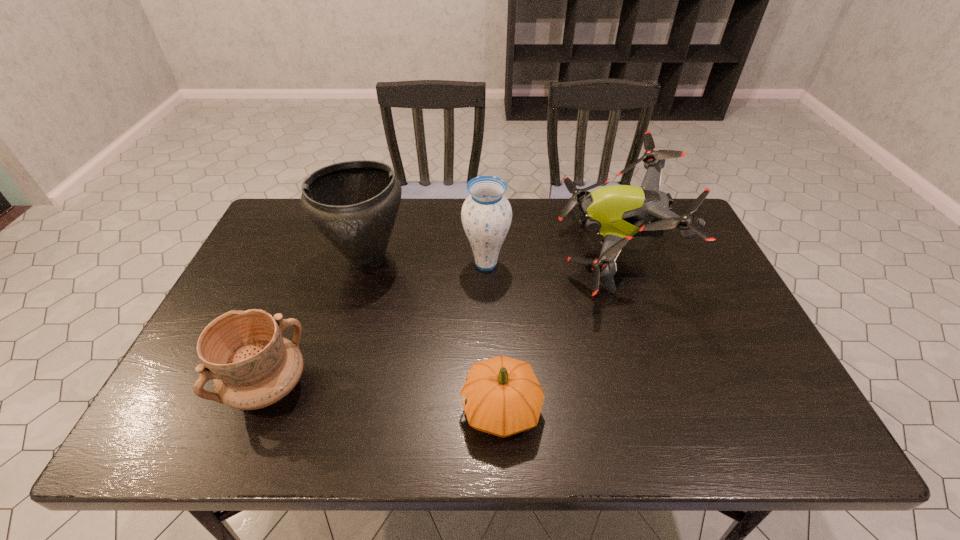
You are a GUI agent. You are given a task and a screenshot of the screen. Output one action in this format:
    pyautogui.click(x=<x>, y=<y>)
    Task: Click on the rightmost object
    
    Given the screenshot: What is the action you would take?
    pyautogui.click(x=617, y=213)

Where is `urn`? The width and height of the screenshot is (960, 540). urn is located at coordinates (354, 204).

The image size is (960, 540). Find the location of `vase`. vase is located at coordinates (486, 215).

Identify the location of the fourth tallest object. (252, 366).

Identify the location of the shortest object. The image size is (960, 540). (501, 396).

I want to click on free space located on the front-facing side of the rightmost object, so click(x=501, y=252).

Identify the location of free space located 0.110m on the front-facing side of the rightmost object. [x=524, y=252].

Locate an element on the screen. Image resolution: width=960 pixels, height=540 pixels. vacant space located 0.360m on the front-facing side of the rightmost object is located at coordinates (443, 252).

Find the location of a particular element. The image size is (960, 540). blank space located on the right of the urn is located at coordinates (520, 258).

The height and width of the screenshot is (540, 960). Identify the location of blank space located on the left of the vase. (392, 264).